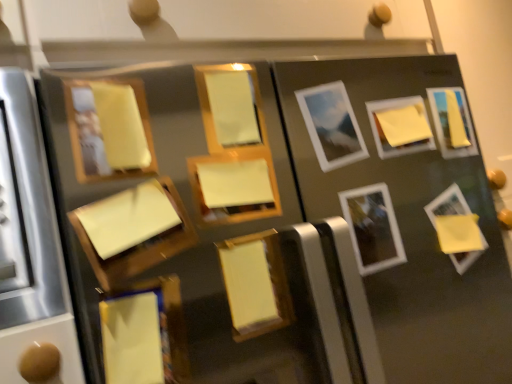
Question: Are matte yellow picture frame at center, placed as the fourth picture frame when sorted from left to right, and yellow matte picture frame at center, the sixth picture frame from the right, beside each other?

Choices:
 (A) no
 (B) yes

Answer: (A)

Question: Can you confirm if matte yellow picture frame at center, which is the 8th picture frame in right-to-left order, is bigger than yellow matte picture frame at center, the sixth picture frame from the right?

Choices:
 (A) yes
 (B) no

Answer: (A)

Question: From the image's perspective, is matte yellow picture frame at center, which is the 8th picture frame in right-to-left order, on top of yellow matte picture frame at center, the sixth picture frame from the right?

Choices:
 (A) no
 (B) yes

Answer: (B)

Question: Is yellow matte picture frame at center, acting as the sixth picture frame starting from the left, at the back of matte yellow picture frame at center, which is the 8th picture frame in right-to-left order?

Choices:
 (A) no
 (B) yes

Answer: (A)

Question: Is there a large distance between matte yellow picture frame at center, which is the 8th picture frame in right-to-left order, and yellow matte picture frame at center, the sixth picture frame from the right?

Choices:
 (A) no
 (B) yes

Answer: (A)

Question: From a real-world perspective, is matte wood picture frame at upper left, which is counted as the eleventh picture frame, starting from the right, positioned above or below yellow matte picture frame at lower right, which is the 2th picture frame from right to left?

Choices:
 (A) above
 (B) below

Answer: (A)

Question: Would you say matte wood picture frame at upper left, which is counted as the eleventh picture frame, starting from the right, is to the left or to the right of yellow matte picture frame at lower right, which is the 2th picture frame from right to left, in the picture?

Choices:
 (A) left
 (B) right

Answer: (A)

Question: Which is correct: matte wood picture frame at upper left, which ranks as the first picture frame in left-to-right order, is inside yellow matte picture frame at lower right, which is the 2th picture frame from right to left, or outside of it?

Choices:
 (A) inside
 (B) outside

Answer: (B)

Question: Is matte wood picture frame at upper left, which ranks as the first picture frame in left-to-right order, in front of or behind yellow matte picture frame at lower right, which is the 2th picture frame from right to left, in the image?

Choices:
 (A) behind
 (B) front

Answer: (B)

Question: Considering their positions, is yellow matte picture frame at center, the sixth picture frame from the right, located in front of or behind white glossy picture frame at center-right, the fourth picture frame in the right-to-left sequence?

Choices:
 (A) behind
 (B) front

Answer: (B)

Question: Does point (232, 302) appear closer or farther from the camera than point (373, 213)?

Choices:
 (A) farther
 (B) closer

Answer: (B)

Question: Is yellow matte picture frame at center, the sixth picture frame from the right, wider or thinner than white glossy picture frame at center-right, the fourth picture frame in the right-to-left sequence?

Choices:
 (A) thin
 (B) wide

Answer: (A)

Question: Looking at the image, does yellow matte picture frame at center, acting as the sixth picture frame starting from the left, seem bigger or smaller compared to white glossy picture frame at center-right, the eighth picture frame from the left?

Choices:
 (A) small
 (B) big

Answer: (A)

Question: Is point (247, 89) closer or farther from the camera than point (184, 349)?

Choices:
 (A) closer
 (B) farther

Answer: (B)

Question: Is matte yellow picture frame at center, placed as the fourth picture frame when sorted from left to right, bigger or smaller than yellow matte picture frame at lower left, the ninth picture frame in the right-to-left sequence?

Choices:
 (A) small
 (B) big

Answer: (A)